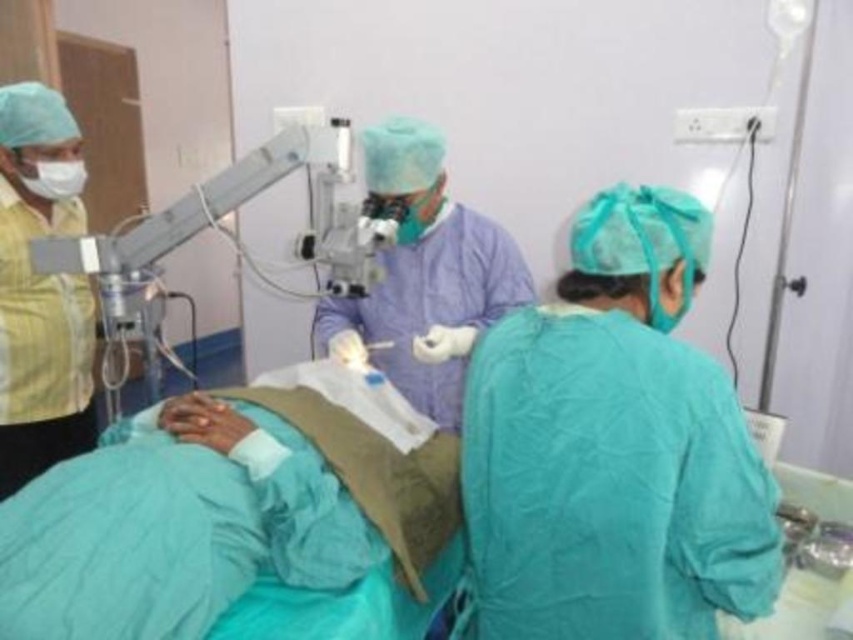
You are a medical student trying to get a better view of the procedure being performed by the metallic microscope at upper center. There is a yellow cotton shirt at left blocking your view. Can you move around to see the procedure clearly?

The yellow cotton shirt at left is positioned over the metallic microscope at upper center, so moving around to the side might allow you to see the procedure clearly.

Looking at this image, you are a medical student observing the procedure. You need to hand a tool to the person in the purple smooth surgical gown at center and the yellow cotton shirt at left. Which one should you approach first based on their proximity to you?

You should approach the purple smooth surgical gown at center first because they are closer to you than the yellow cotton shirt at left.

You are a medical intern who needs to identify the shortest garment among the purple smooth surgical gown at center and the yellow cotton shirt at left. Which one should you report?

The purple smooth surgical gown at center is shorter than the yellow cotton shirt at left, so you should report the purple smooth surgical gown at center as the shortest garment.